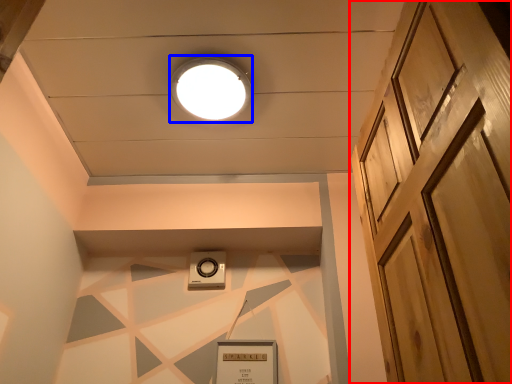
Question: Which point is further to the camera, door (highlighted by a red box) or droplight (highlighted by a blue box)?

Choices:
 (A) door
 (B) droplight

Answer: (B)